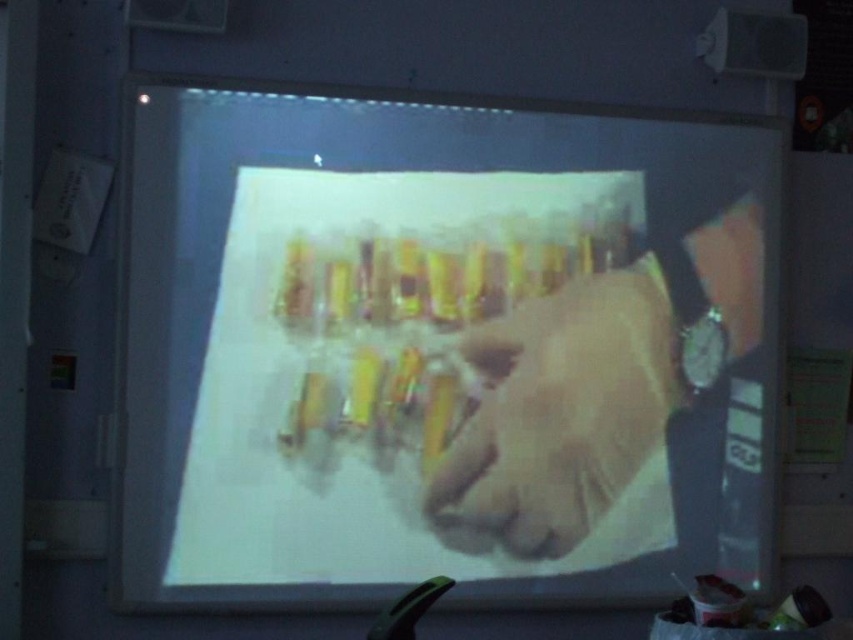
You are standing in front of the projection screen and notice two points marked on it. The first point is at coordinates point (683, 140) and the second is at point (595, 396). Which of these two points is closer to your eyes?

Point (683, 140) is further to the camera than point (595, 396), so the point closer to your eyes is point (595, 396).